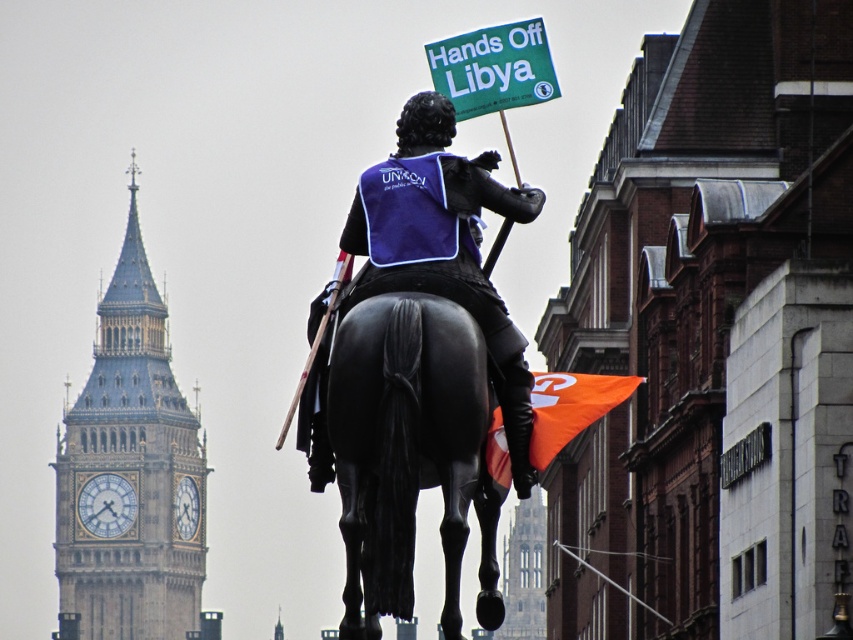
Question: Among these objects, which one is farthest from the camera?

Choices:
 (A) shiny black statue at center
 (B) stone gothic cathedral at center
 (C) orange fabric flag at lower right
 (D) black polished horse at center

Answer: (C)

Question: Is orange fabric flag at lower right further to the viewer compared to stone gothic cathedral at center?

Choices:
 (A) no
 (B) yes

Answer: (B)

Question: Based on their relative distances, which object is farther from the stone gothic cathedral at center?

Choices:
 (A) black polished horse at center
 (B) stone clock tower at left
 (C) orange fabric flag at lower right
 (D) green paper sign at upper center

Answer: (D)

Question: Is black polished horse at center positioned behind stone gothic cathedral at center?

Choices:
 (A) yes
 (B) no

Answer: (B)

Question: Which point is closer to the camera taking this photo?

Choices:
 (A) (184, 596)
 (B) (436, 144)

Answer: (B)

Question: Is stone clock tower at left further to camera compared to stone gothic cathedral at center?

Choices:
 (A) yes
 (B) no

Answer: (A)